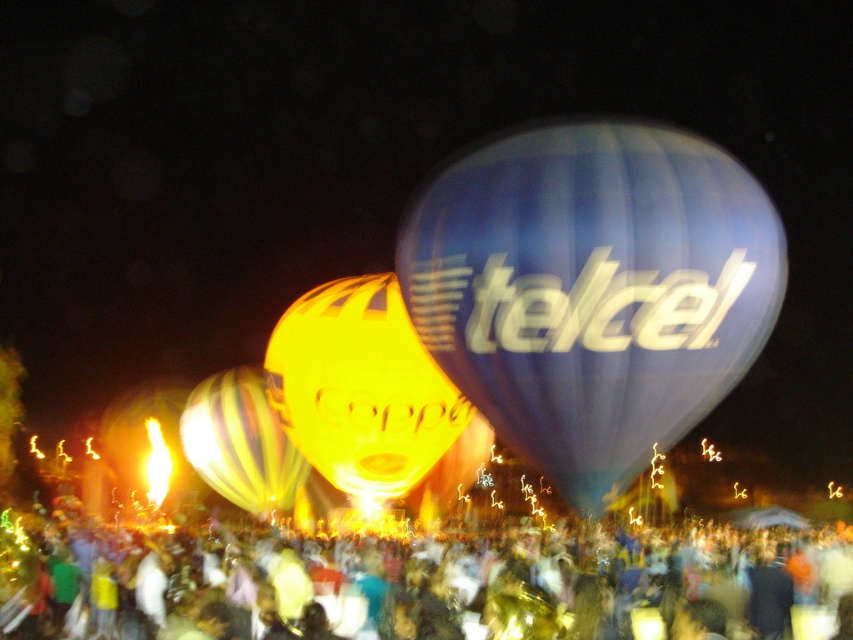
Between shiny yellow balloon at center and multicolored striped balloon at center, which one is positioned higher?

shiny yellow balloon at center

Locate an element on the screen. The height and width of the screenshot is (640, 853). shiny yellow balloon at center is located at coordinates (361, 388).

Is point (368, 381) positioned in front of point (265, 461)?

Yes, point (368, 381) is in front of point (265, 461).

Where is `shiny yellow balloon at center`? shiny yellow balloon at center is located at coordinates (361, 388).

Who is more forward, (670, 156) or (358, 358)?

Point (670, 156)

Which is behind, point (585, 170) or point (469, 451)?

Point (469, 451)

Who is more distant from viewer, [693,269] or [407,444]?

Point [407,444]

Identify the location of blue glossy balloon at center. (593, 291).

How distant is multicolored fabric crowd at lower center from multicolored striped balloon at center?

They are 37.59 meters apart.

Does multicolored fabric crowd at lower center have a lesser width compared to multicolored striped balloon at center?

No.

Between point (271, 563) and point (280, 461), which one is positioned in front?

Point (271, 563) is more forward.

Identify the location of multicolored fabric crowd at lower center. (418, 586).